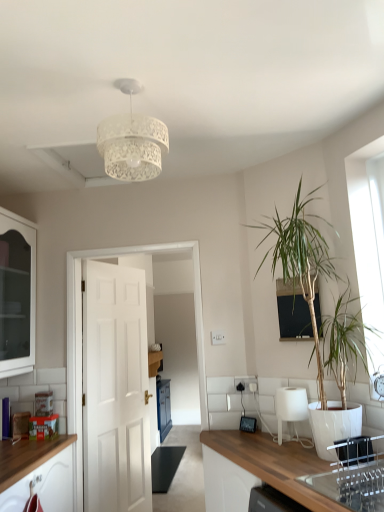
Question: Would you say white lace lampshade at upper center is to the left or to the right of white glass cabinet at left in the picture?

Choices:
 (A) right
 (B) left

Answer: (A)

Question: Looking at the image, does white lace lampshade at upper center seem bigger or smaller compared to white glass cabinet at left?

Choices:
 (A) small
 (B) big

Answer: (A)

Question: Which is nearer to the white glass cabinet at left?

Choices:
 (A) clear glass sink at lower right
 (B) black glass window screen at upper center
 (C) white matte door at center
 (D) white lace lampshade at upper center
 (E) green leafy plant at right

Answer: (C)

Question: Which is farther from the white matte door at center?

Choices:
 (A) green leafy plant at right
 (B) white glossy lampshade at lower center
 (C) white lace lampshade at upper center
 (D) clear glass sink at lower right
 (E) white glass cabinet at left

Answer: (C)